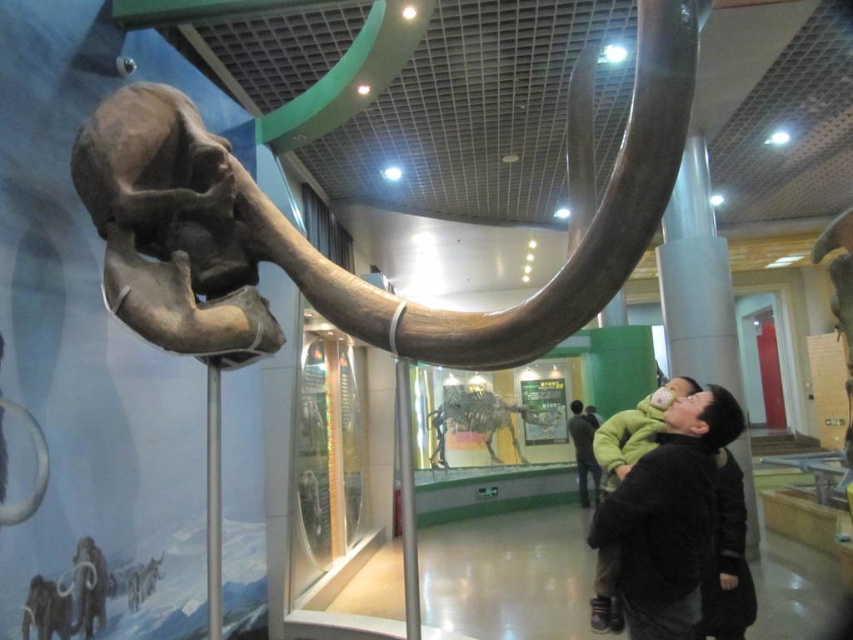
Question: Can you confirm if polished gray elephant tusk at upper left is wider than black fuzzy coat at lower right?

Choices:
 (A) no
 (B) yes

Answer: (B)

Question: Is black fuzzy coat at lower right thinner than dark gray sweater at center?

Choices:
 (A) no
 (B) yes

Answer: (A)

Question: Which point is farther from the camera taking this photo?

Choices:
 (A) (590, 435)
 (B) (639, 600)
 (C) (131, 285)

Answer: (A)

Question: Observing the image, what is the correct spatial positioning of polished gray elephant tusk at upper left in reference to dark gray sweater at center?

Choices:
 (A) below
 (B) above

Answer: (B)

Question: Which is farther from the polished gray elephant tusk at upper left?

Choices:
 (A) dark gray sweater at center
 (B) black fuzzy coat at lower right

Answer: (A)

Question: Which object is farther from the camera taking this photo?

Choices:
 (A) polished gray elephant tusk at upper left
 (B) dark gray sweater at center
 (C) black fuzzy coat at lower right

Answer: (B)